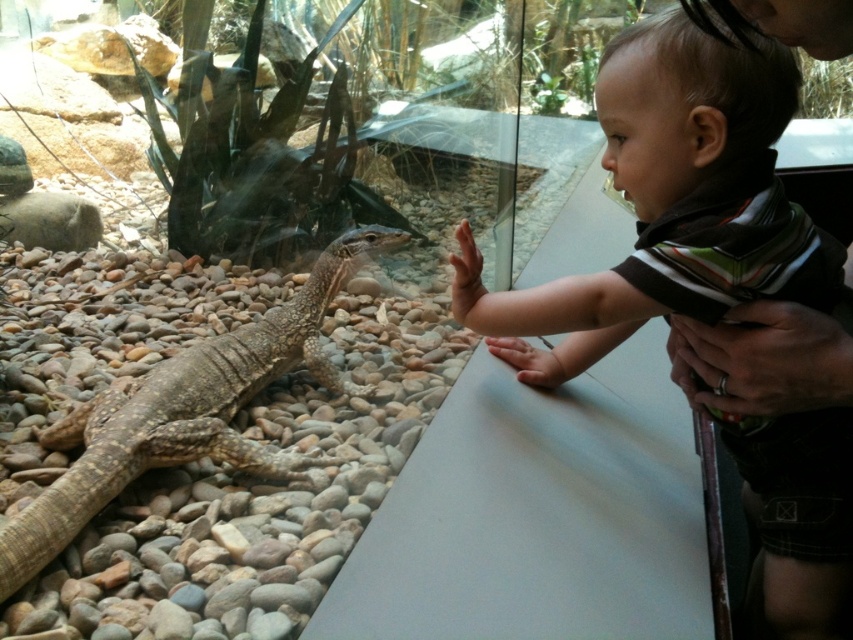
Question: Is smooth brown toddler at center to the right of brown textured lizard at left from the viewer's perspective?

Choices:
 (A) yes
 (B) no

Answer: (A)

Question: Does smooth brown toddler at center come in front of brown textured lizard at left?

Choices:
 (A) yes
 (B) no

Answer: (A)

Question: Where is smooth brown toddler at center located in relation to brown textured lizard at left in the image?

Choices:
 (A) left
 (B) right

Answer: (B)